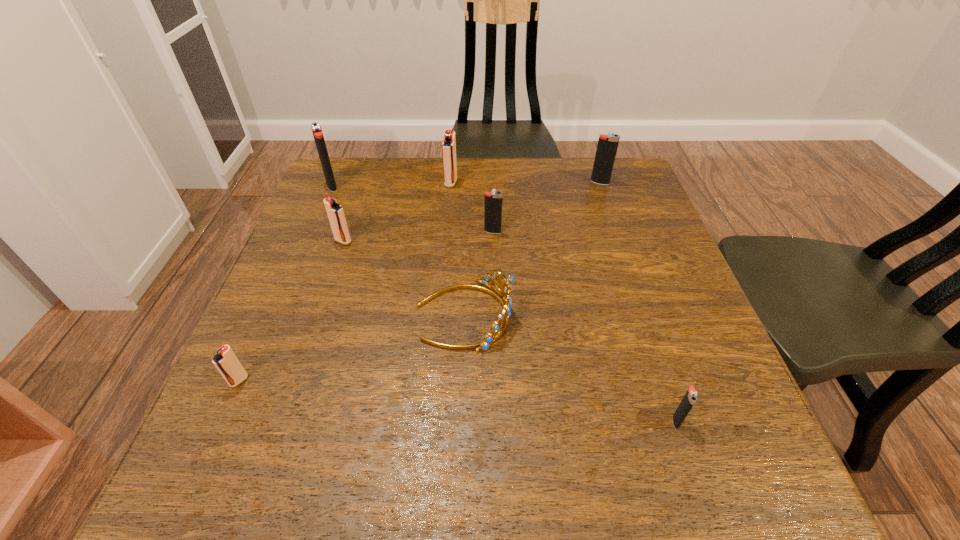
Identify which object is located as the fifth nearest to the nearest object. Please provide its 2D coordinates. Your answer should be formatted as a tuple, i.e. [(x, y)], where the tuple contains the x and y coordinates of a point satisfying the conditions above.

[(335, 212)]

You are a GUI agent. You are given a task and a screenshot of the screen. Output one action in this format:
    pyautogui.click(x=<x>, y=<y>)
    Task: Click on the object that stands as the third closest to the tallest object
    The width and height of the screenshot is (960, 540).
    Given the screenshot: What is the action you would take?
    pyautogui.click(x=505, y=300)

Point out which igniter is positioned as the third nearest to the biggest black igniter. Please provide its 2D coordinates. Your answer should be formatted as a tuple, i.e. [(x, y)], where the tuple contains the x and y coordinates of a point satisfying the conditions above.

[(493, 200)]

The height and width of the screenshot is (540, 960). What are the coordinates of `igniter that stands as the fifth closest to the tallest igniter` in the screenshot? It's located at (607, 146).

Locate which black igniter ranks third in proximity to the rightmost red igniter. Please provide its 2D coordinates. Your answer should be formatted as a tuple, i.e. [(x, y)], where the tuple contains the x and y coordinates of a point satisfying the conditions above.

[(607, 146)]

Locate which black igniter ranks third in proximity to the second biggest black igniter. Please provide its 2D coordinates. Your answer should be formatted as a tuple, i.e. [(x, y)], where the tuple contains the x and y coordinates of a point satisfying the conditions above.

[(318, 136)]

Locate an element on the screen. The image size is (960, 540). the second closest red igniter to the second nearest igniter is located at coordinates (449, 140).

Find the location of `red igniter that stands as the second closest to the smallest red igniter`. red igniter that stands as the second closest to the smallest red igniter is located at coordinates (449, 140).

At what (x,y) coordinates should I click in order to perform the action: click on free space that satisfies the following two spatial constraints: 1. on the front side of the fourth farthest object; 2. on the front-facing side of the tiara. Please return your answer as a coordinate pair (x, y). Image resolution: width=960 pixels, height=540 pixels. Looking at the image, I should click on (495, 315).

In order to click on vacant space that satisfies the following two spatial constraints: 1. on the back side of the leftmost black igniter; 2. on the left side of the nearest red igniter in this screenshot , I will do pyautogui.click(x=324, y=186).